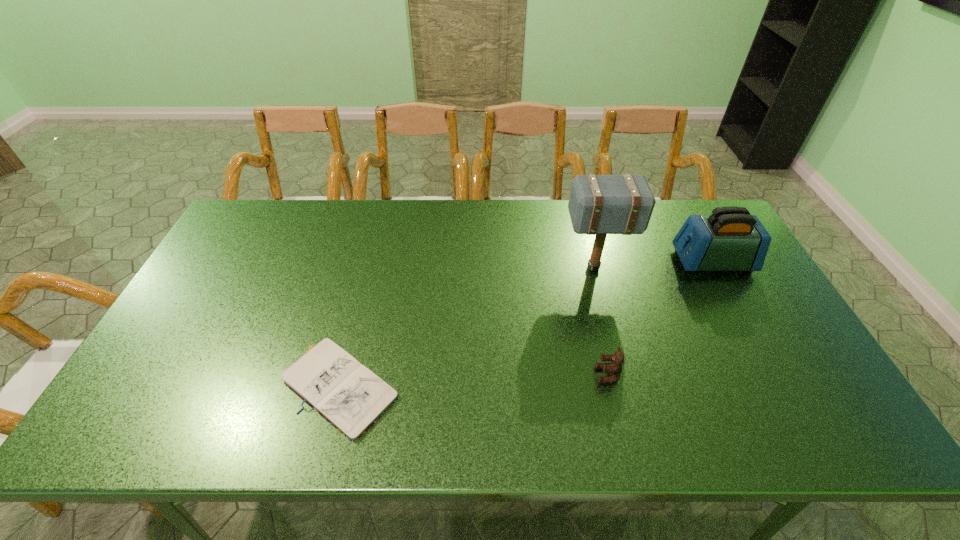
You are a GUI agent. You are given a task and a screenshot of the screen. Output one action in this format:
    pyautogui.click(x=<x>, y=<y>)
    Task: Click on the mallet
    
    Given the screenshot: What is the action you would take?
    pyautogui.click(x=623, y=204)

I want to click on the rightmost object, so click(x=730, y=239).

Where is `the third shortest object`? The height and width of the screenshot is (540, 960). the third shortest object is located at coordinates [730, 239].

You are a GUI agent. You are given a task and a screenshot of the screen. Output one action in this format:
    pyautogui.click(x=<x>, y=<y>)
    Task: Click on the teddy bear
    The width and height of the screenshot is (960, 540).
    Given the screenshot: What is the action you would take?
    [x=614, y=368]

I want to click on the leftmost object, so click(x=347, y=394).

Image resolution: width=960 pixels, height=540 pixels. I want to click on notebook, so click(347, 394).

This screenshot has width=960, height=540. What are the coordinates of `free space located on the striking surface of the tallest object` in the screenshot? It's located at (464, 268).

The height and width of the screenshot is (540, 960). Find the location of `vacant position located 0.090m on the striking surface of the tallest object`. vacant position located 0.090m on the striking surface of the tallest object is located at coordinates (533, 268).

Image resolution: width=960 pixels, height=540 pixels. Identify the location of blank area located on the striking surface of the tallest object. (539, 268).

Where is `free space located 0.050m on the front-facing side of the second tallest object`? free space located 0.050m on the front-facing side of the second tallest object is located at coordinates (660, 261).